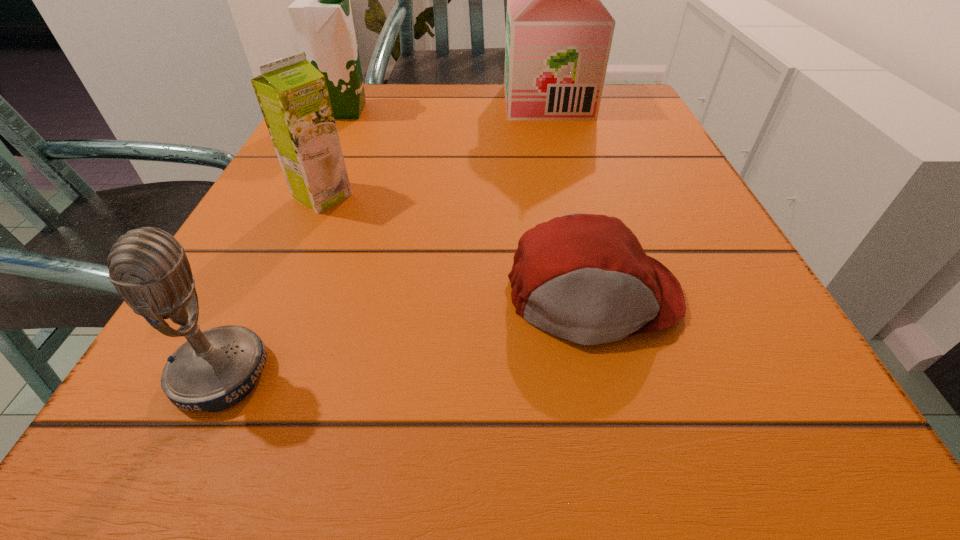
Find the location of `free space between the nearest soya milk and the microphone`. free space between the nearest soya milk and the microphone is located at coordinates (272, 285).

Image resolution: width=960 pixels, height=540 pixels. I want to click on vacant region between the shortest object and the third nearest object, so pyautogui.click(x=458, y=247).

Locate an element on the screen. The height and width of the screenshot is (540, 960). object that is the fourth closest to the cap is located at coordinates (321, 14).

Find the location of `object that is the fourth closest to the third farthest object`. object that is the fourth closest to the third farthest object is located at coordinates (558, 32).

Where is `soya milk that stands as the closest to the third nearest object`? The height and width of the screenshot is (540, 960). soya milk that stands as the closest to the third nearest object is located at coordinates (321, 14).

Identify which soya milk is the second closest to the microphone. Please provide its 2D coordinates. Your answer should be formatted as a tuple, i.e. [(x, y)], where the tuple contains the x and y coordinates of a point satisfying the conditions above.

[(321, 14)]

Image resolution: width=960 pixels, height=540 pixels. I want to click on vacant area that satisfies the following two spatial constraints: 1. on the front side of the third farthest object; 2. on the front-facing side of the microphone, so click(244, 374).

Locate an element on the screen. This screenshot has height=540, width=960. vacant area in the image that satisfies the following two spatial constraints: 1. on the front-facing side of the shortest object; 2. on the front-facing side of the microphone is located at coordinates (612, 374).

At what (x,y) coordinates should I click in order to perform the action: click on vacant space that satisfies the following two spatial constraints: 1. with the cap open on the rightmost soya milk; 2. on the front-facing side of the shortest object. Please return your answer as a coordinate pair (x, y). The width and height of the screenshot is (960, 540). Looking at the image, I should click on (597, 297).